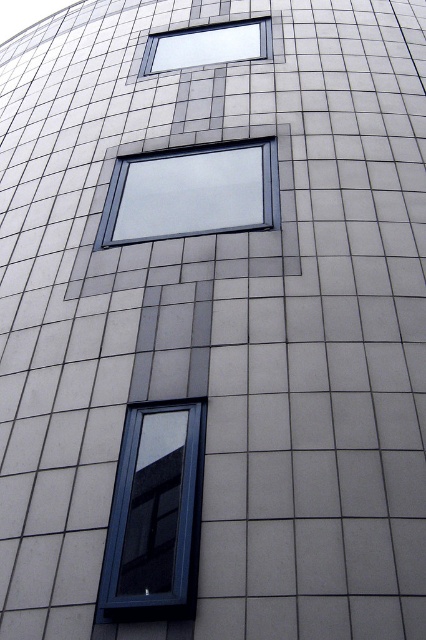
Between point (138, 500) and point (137, 221), which one is positioned in front?

Point (138, 500) is in front.

Between point (126, 602) and point (120, 193), which one is positioned behind?

The point (120, 193) is more distant.

Where is `matte black window at lower left`? Image resolution: width=426 pixels, height=640 pixels. matte black window at lower left is located at coordinates (155, 515).

At what (x,y) coordinates should I click in order to perform the action: click on matte black window at lower left. Please return your answer as a coordinate pair (x, y). The width and height of the screenshot is (426, 640). Looking at the image, I should click on (155, 515).

The image size is (426, 640). Identify the location of matte black window at lower left. (155, 515).

Does point (167, 595) come in front of point (224, 60)?

Yes.

Locate an element on the screen. This screenshot has width=426, height=640. matte black window at lower left is located at coordinates (155, 515).

Can you confirm if matte glass window at center is wider than matte glass window at upper center?

No.

Who is shorter, matte glass window at center or matte glass window at upper center?

Standing shorter between the two is matte glass window at upper center.

Where is `matte glass window at center`? The width and height of the screenshot is (426, 640). matte glass window at center is located at coordinates (192, 193).